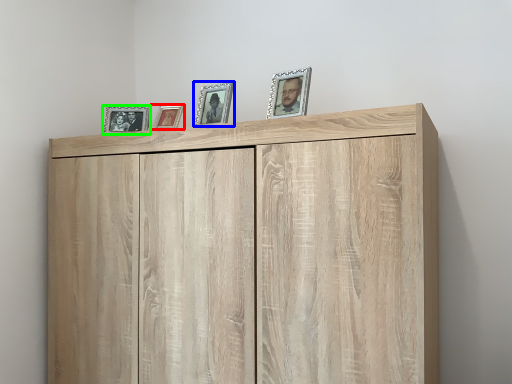
Question: Estimate the real-world distances between objects in this image. Which object is closer to picture frame (highlighted by a red box), picture frame (highlighted by a blue box) or picture frame (highlighted by a green box)?

Choices:
 (A) picture frame
 (B) picture frame

Answer: (B)